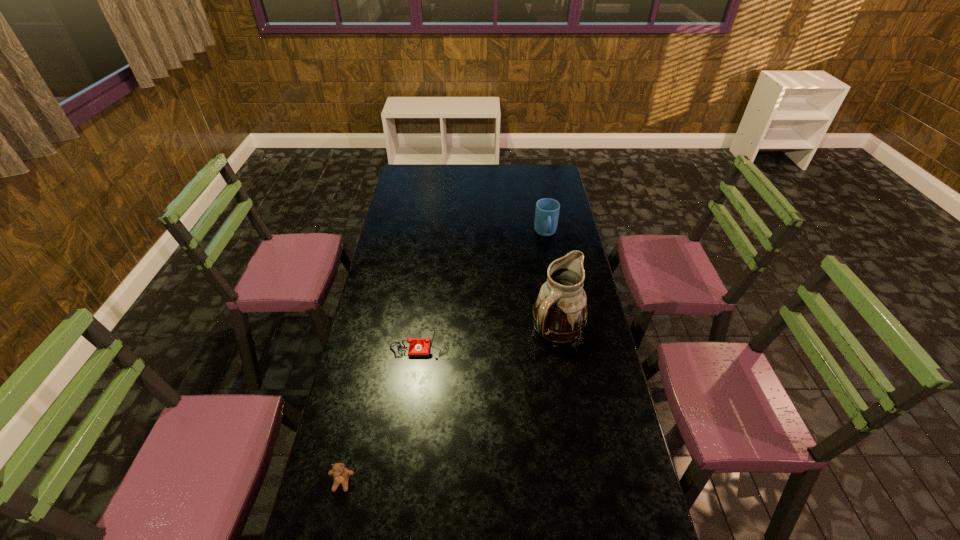
Locate an element on the screen. This screenshot has height=540, width=960. unoccupied position between the second shortest object and the tallest object is located at coordinates (450, 406).

This screenshot has height=540, width=960. I want to click on vacant space in between the farthest object and the third tallest object, so click(444, 358).

You are a GUI agent. You are given a task and a screenshot of the screen. Output one action in this format:
    pyautogui.click(x=<x>, y=<y>)
    Task: Click on the object that is the nearest to the telephone
    
    Given the screenshot: What is the action you would take?
    pyautogui.click(x=560, y=312)

The width and height of the screenshot is (960, 540). Identify the location of object that ranks as the third closest to the nearest object. (547, 210).